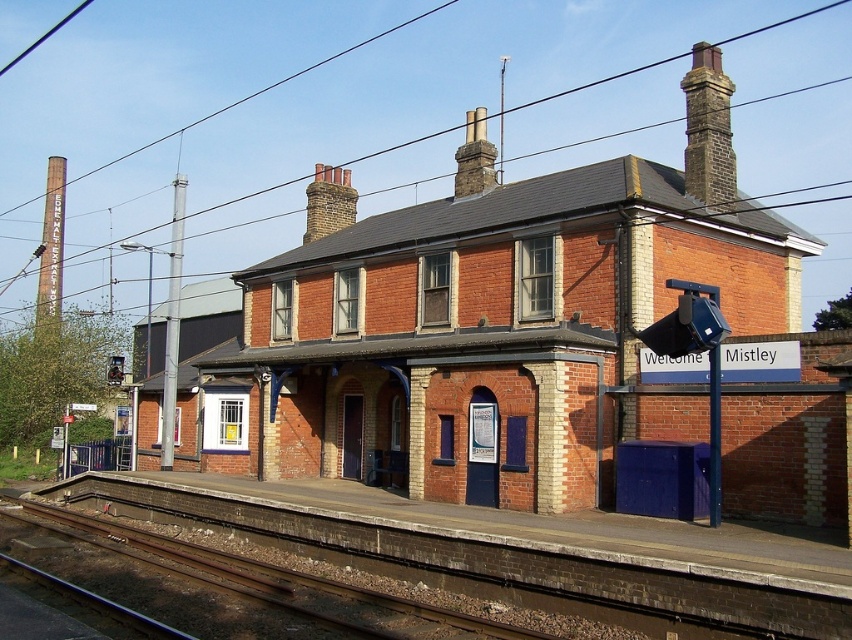
Is rusty metal train track at lower left positioned before dark brown stone chimney at upper right?

That is True.

Locate an element on the screen. Image resolution: width=852 pixels, height=640 pixels. rusty metal train track at lower left is located at coordinates (262, 579).

Between point (280, 584) and point (717, 109), which one is positioned behind?

Positioned behind is point (717, 109).

Find the location of a particular element. The image size is (852, 640). rusty metal train track at lower left is located at coordinates (262, 579).